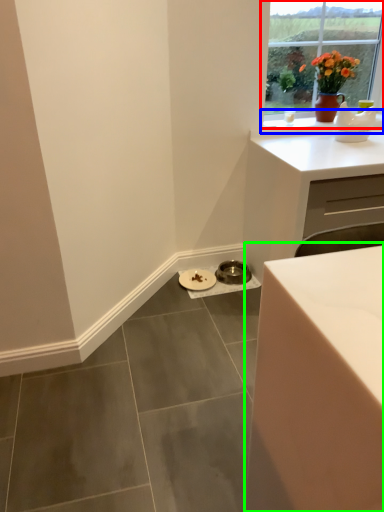
Question: Which object is the closest to the window (highlighted by a red box)? Choose among these: window sill (highlighted by a blue box) or table (highlighted by a green box).

Choices:
 (A) window sill
 (B) table

Answer: (A)